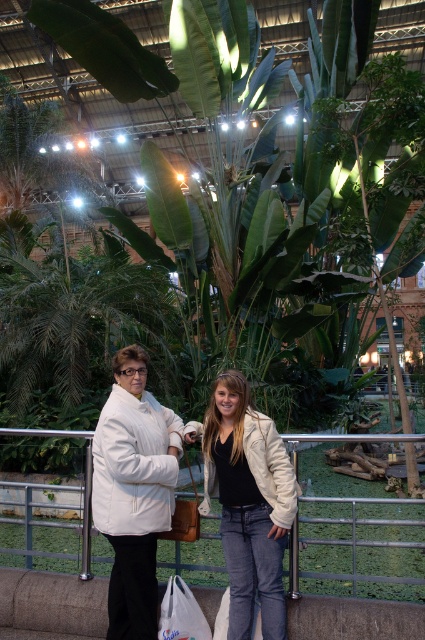
You are a photographer trying to capture a photo of the two objects mentioned. Since the denim jacket at center and white fabric bag at lower center are both in the frame, which one will appear larger in the photo?

The denim jacket at center will appear larger in the photo because it is taller than the white fabric bag at lower center.

You are a photographer trying to capture a closeup of the white fabric bag at lower center without including the denim jacket at center in the frame. Given their sizes, is this feasible?

The denim jacket at center is wider than the white fabric bag at lower center, so it might be challenging to frame the bag without including the jacket if they are positioned closely together.